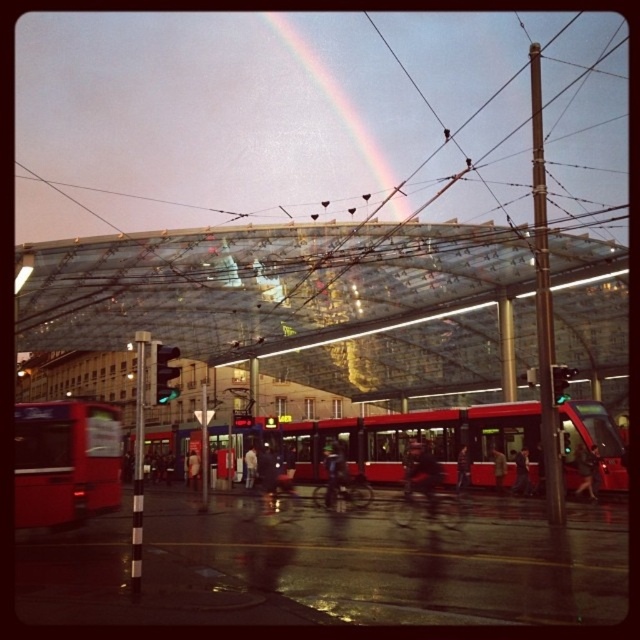
Question: Which object is the closest to the matte red bus at left?

Choices:
 (A) red matte articulated bus at center
 (B) transparent glass railway station at center

Answer: (A)

Question: Can you confirm if transparent glass railway station at center is wider than matte red bus at left?

Choices:
 (A) no
 (B) yes

Answer: (B)

Question: Does transparent glass railway station at center appear on the left side of red matte articulated bus at center?

Choices:
 (A) yes
 (B) no

Answer: (A)

Question: Which object is the farthest from the matte red bus at left?

Choices:
 (A) transparent glass railway station at center
 (B) red matte articulated bus at center

Answer: (A)

Question: Can you confirm if transparent glass railway station at center is positioned to the right of red matte articulated bus at center?

Choices:
 (A) yes
 (B) no

Answer: (B)

Question: Which point is closer to the camera taking this photo?

Choices:
 (A) (x=499, y=435)
 (B) (x=568, y=602)

Answer: (B)